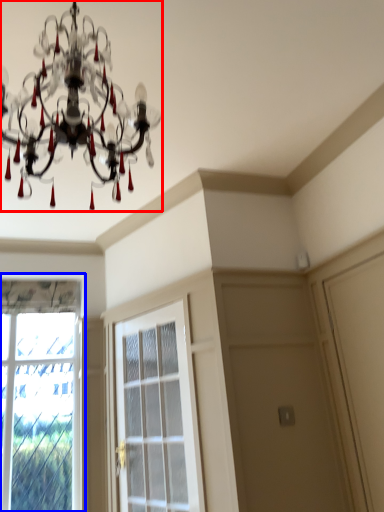
Question: Which object appears farthest to the camera in this image, lamp (highlighted by a red box) or window (highlighted by a blue box)?

Choices:
 (A) lamp
 (B) window

Answer: (B)